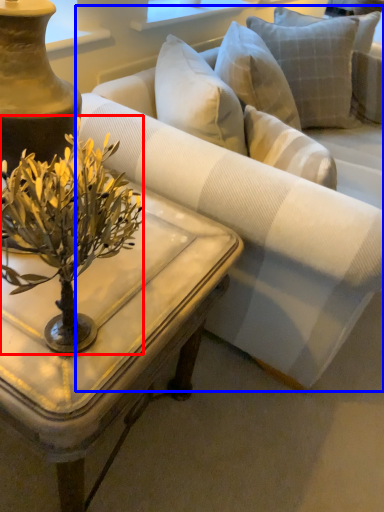
Question: Which of the following is the farthest to the observer, flower (highlighted by a red box) or studio couch (highlighted by a blue box)?

Choices:
 (A) flower
 (B) studio couch

Answer: (B)